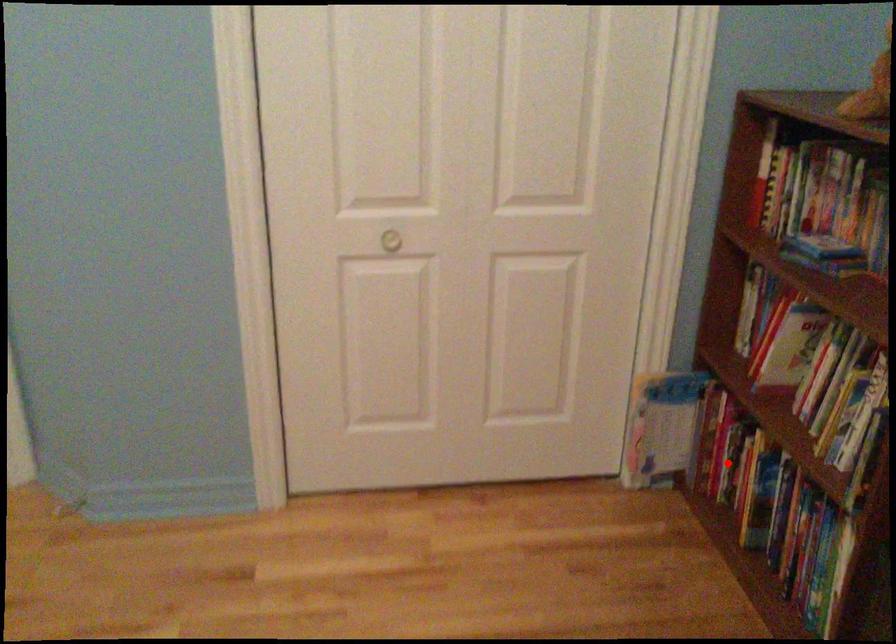
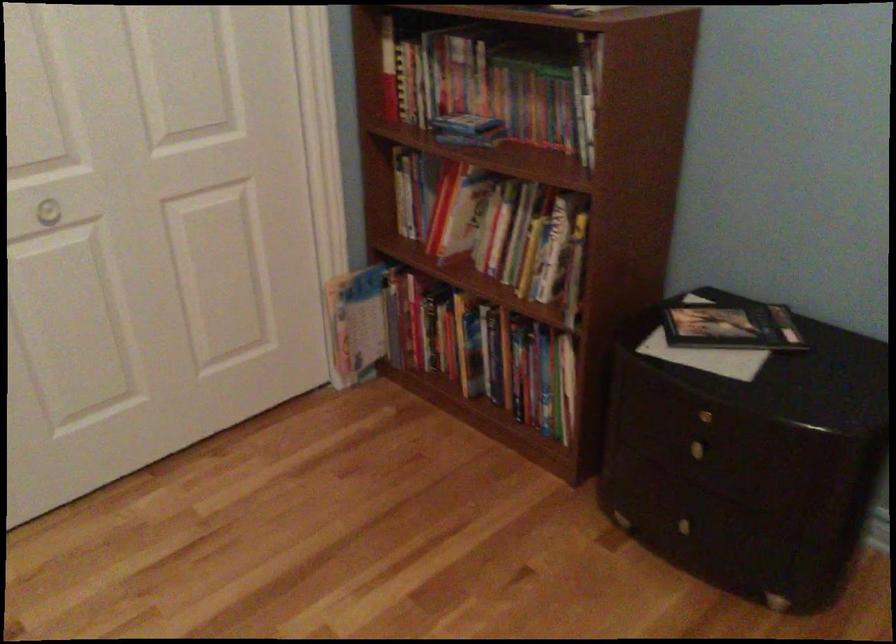
Find the pixel in the second image that matches the highlighted location in the first image.

(428, 335)